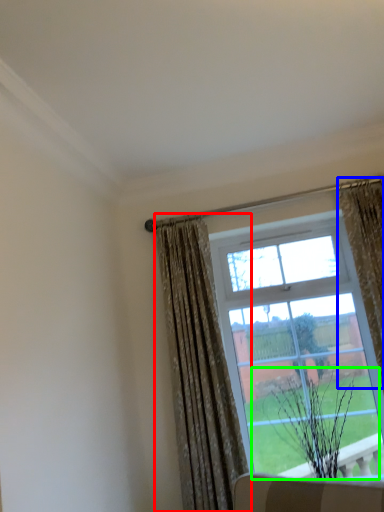
Question: Estimate the real-world distances between objects in this image. Which object is farther from curtain (highlighted by a red box), curtain (highlighted by a blue box) or plant (highlighted by a green box)?

Choices:
 (A) curtain
 (B) plant

Answer: (A)